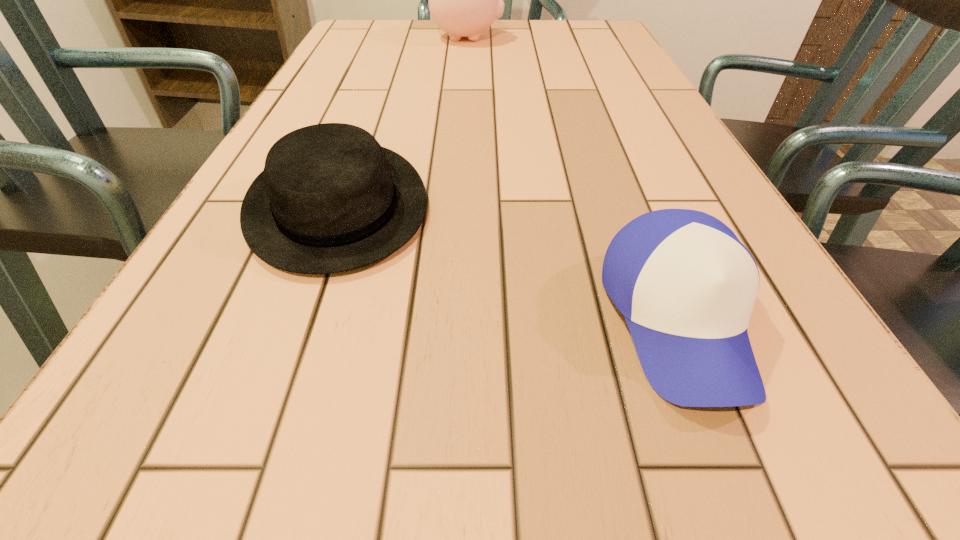
Identify the location of the farthest object. (464, 0).

Where is `piggy bank`? piggy bank is located at coordinates (464, 0).

Locate an element on the screen. baseball cap is located at coordinates (686, 285).

Locate an element on the screen. fedora is located at coordinates (x=330, y=199).

Identify the location of blank space located at the snout of the piggy bank. This screenshot has width=960, height=540. (532, 38).

Locate an element on the screen. This screenshot has width=960, height=540. vacant space located 0.050m on the front-facing side of the rightmost object is located at coordinates (736, 470).

At what (x,y) coordinates should I click in order to perform the action: click on free space located 0.170m on the front of the fedora. Please return your answer as a coordinate pair (x, y). This screenshot has width=960, height=540. Looking at the image, I should click on (266, 397).

I want to click on object situated at the far edge, so click(x=464, y=0).

I want to click on object positioned at the left edge, so click(x=330, y=199).

Image resolution: width=960 pixels, height=540 pixels. I want to click on object positioned at the right edge, so click(686, 285).